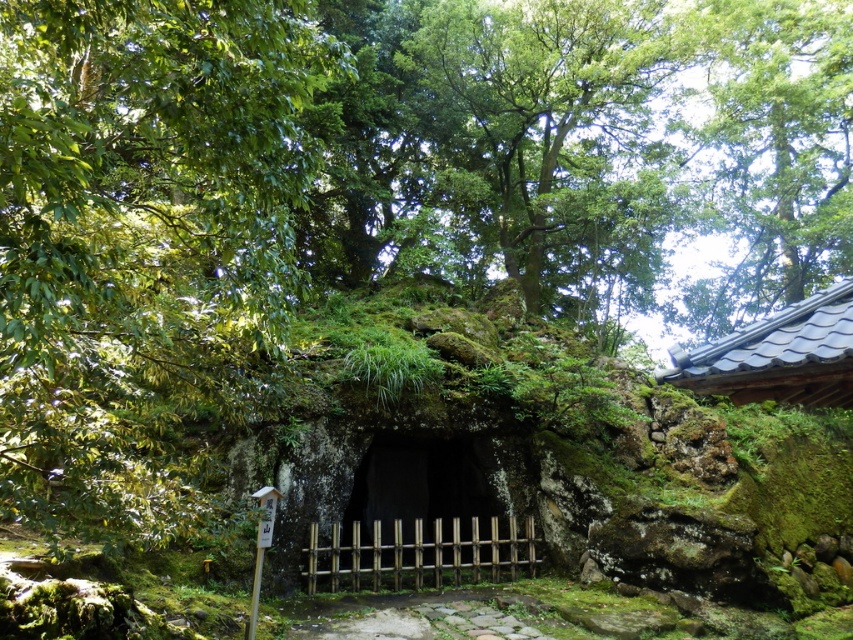
You are a visitor at the cave entrance and want to take a photo of the dark brown wooden gate at center without the green leafy tree at upper left blocking the view. How should you position yourself to achieve this?

Move to the right side of the dark brown wooden gate at center so that the green leafy tree at upper left is no longer in front of it.

You are a hiker standing at the cave entrance and want to take a photo of both the green leafy tree at upper right and the gray tile roof at upper right in the same frame. Can you fit both in your camera view without moving your position?

The green leafy tree at upper right and gray tile roof at upper right are 52.19 feet apart. Since the distance between them is significant, you might need to adjust your position or zoom out to capture both in the same frame.

You are hiking in the forest and see the green leafy tree at upper right and the gray tile roof at upper right. Which one is closer to you?

The green leafy tree at upper right is closer to you because it is in front of the gray tile roof at upper right.